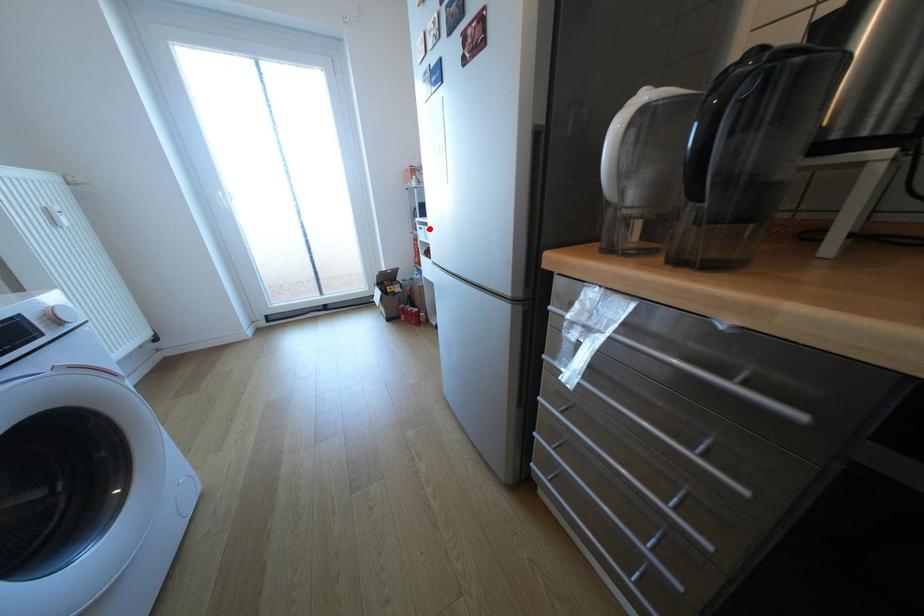
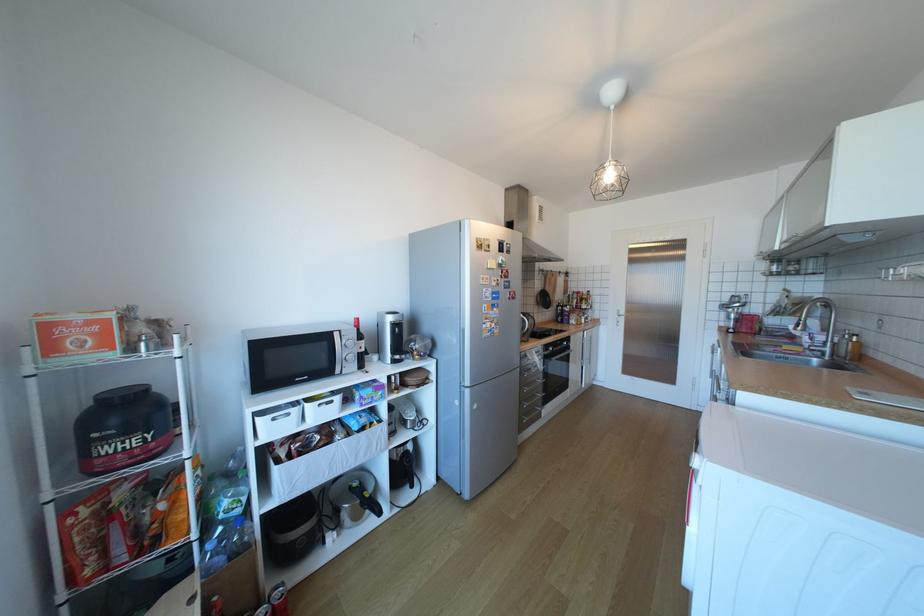
The point at the highlighted location is marked in the first image. Where is the corresponding point in the second image?

(283, 419)